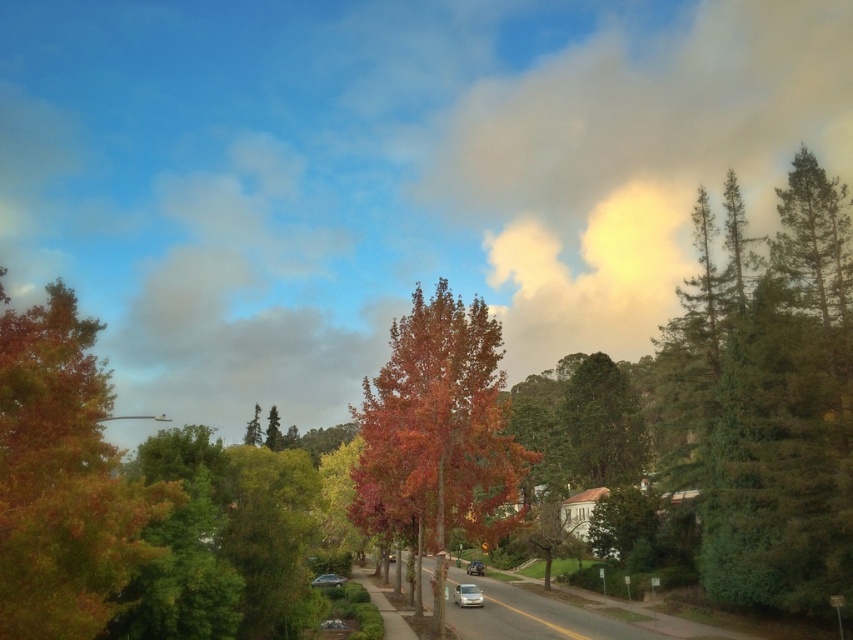
Consider the image. Between orange-brown foliage at center and white matte car at center, which one appears on the right side from the viewer's perspective?

From the viewer's perspective, white matte car at center appears more on the right side.

From the picture: Can you confirm if orange-brown foliage at center is shorter than white matte car at center?

In fact, orange-brown foliage at center may be taller than white matte car at center.

Does point (496, 493) lie in front of point (477, 595)?

Yes, it is in front of point (477, 595).

Where is `orange-brown foliage at center`? Image resolution: width=853 pixels, height=640 pixels. orange-brown foliage at center is located at coordinates (437, 432).

Who is positioned more to the right, smokey yellow cloud at upper center or white matte car at center?

Positioned to the right is smokey yellow cloud at upper center.

Does smokey yellow cloud at upper center appear on the left side of white matte car at center?

Incorrect, smokey yellow cloud at upper center is not on the left side of white matte car at center.

Is point (749, 164) less distant than point (465, 600)?

No, it is behind (465, 600).

I want to click on smokey yellow cloud at upper center, so click(386, 173).

Between point (274, 449) and point (329, 580), which one is positioned behind?

Point (274, 449)

Is point (277, 440) positioned after point (340, 586)?

Yes, it is.

Locate an element on the screen. green matte tree at center is located at coordinates (273, 429).